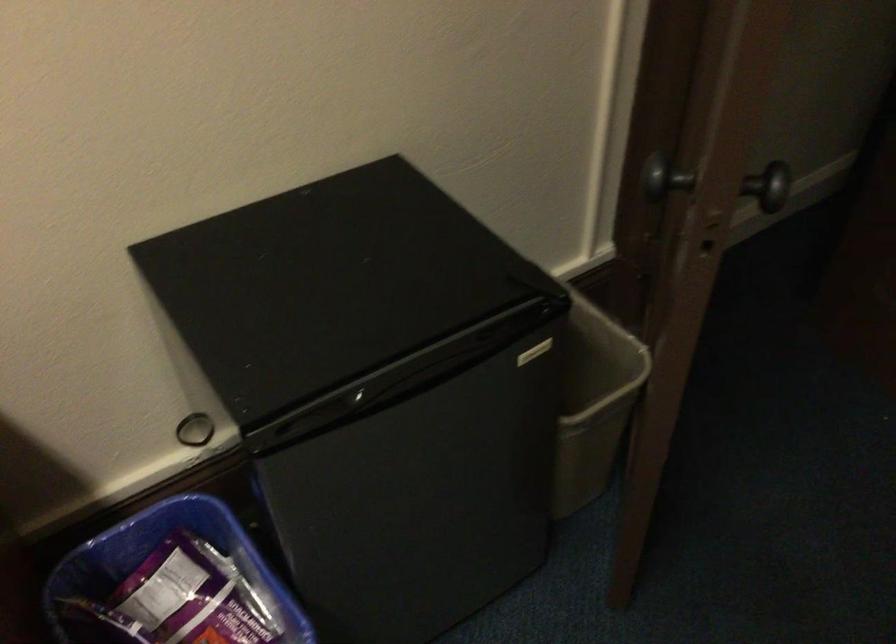
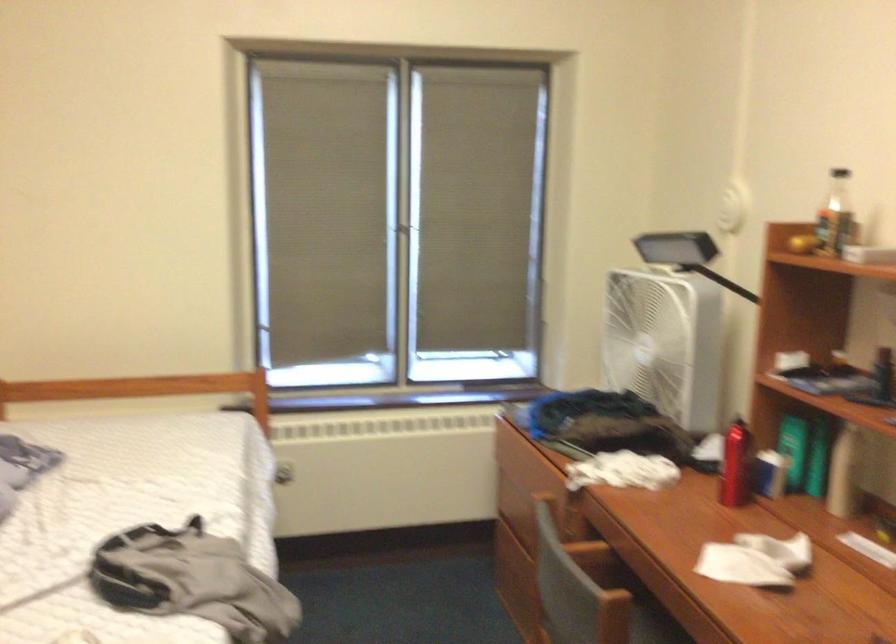
Consider the image. How did the camera likely rotate?

The camera's rotation is toward left-down.